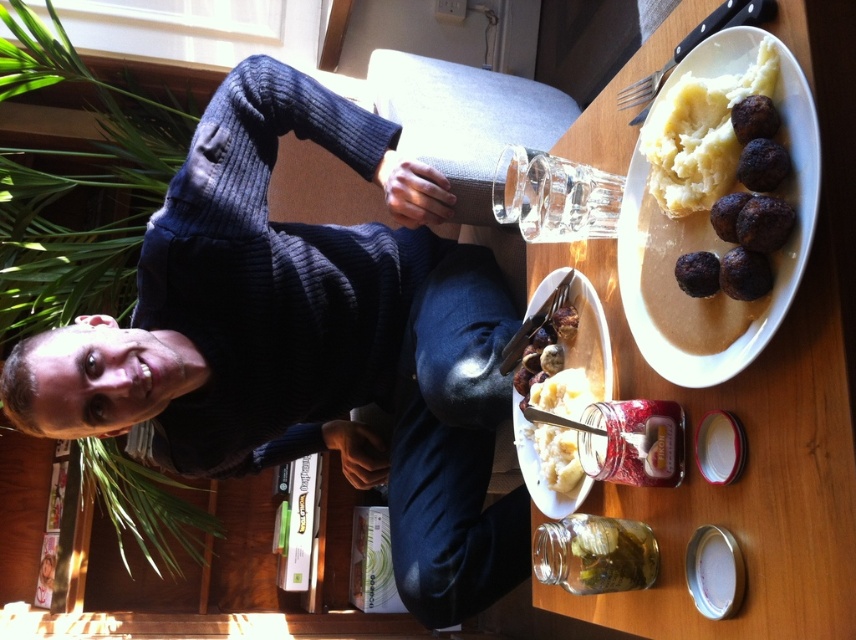
You are a fashion designer observing the scene. You need to determine if the dark blue ribbed sweater at upper center can be folded and placed on the white ceramic plate at upper center without any part of the sweater hanging over the plate. Can this be done?

The dark blue ribbed sweater at upper center is bigger than the white ceramic plate at upper center, so if you try to fold the dark blue ribbed sweater at upper center and place it on the white ceramic plate at upper center, parts of the sweater will hang over the edges of the plate.

You are a chef preparing a dish and need to place the brown matte meatballs at upper right onto the white ceramic plate at upper center. Can the meatballs fit on the plate?

The white ceramic plate at upper center is larger in size than the brown matte meatballs at upper right, so yes, the meatballs can fit on the plate.